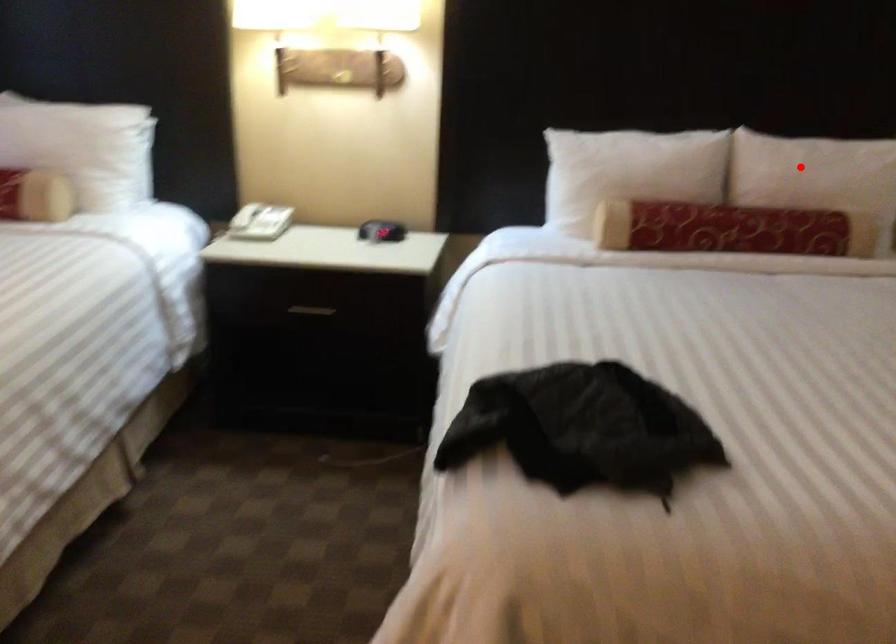
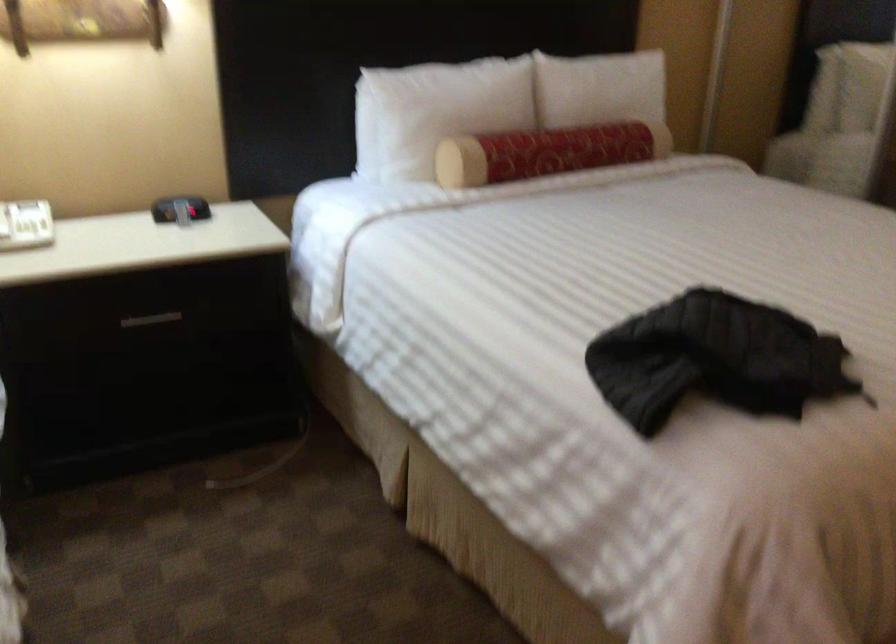
Where in the second image is the point corresponding to the highlighted location from the first image?

(599, 88)